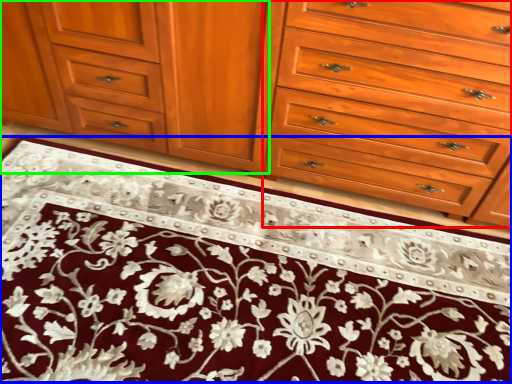
Question: Based on their relative distances, which object is nearer to drawer (highlighted by a red box)? Choose from doormat (highlighted by a blue box) and cabinetry (highlighted by a green box).

Choices:
 (A) doormat
 (B) cabinetry

Answer: (B)